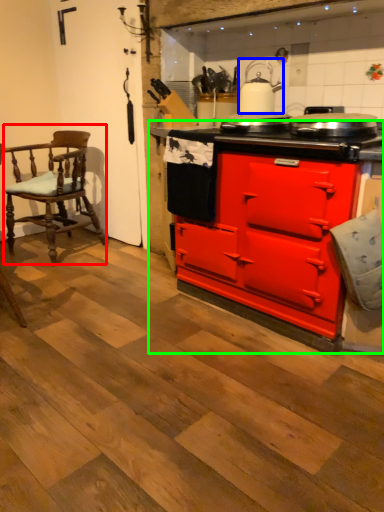
Question: Which is nearer to the chair (highlighted by a red box)? kitchen appliance (highlighted by a blue box) or cabinetry (highlighted by a green box).

Choices:
 (A) kitchen appliance
 (B) cabinetry

Answer: (B)